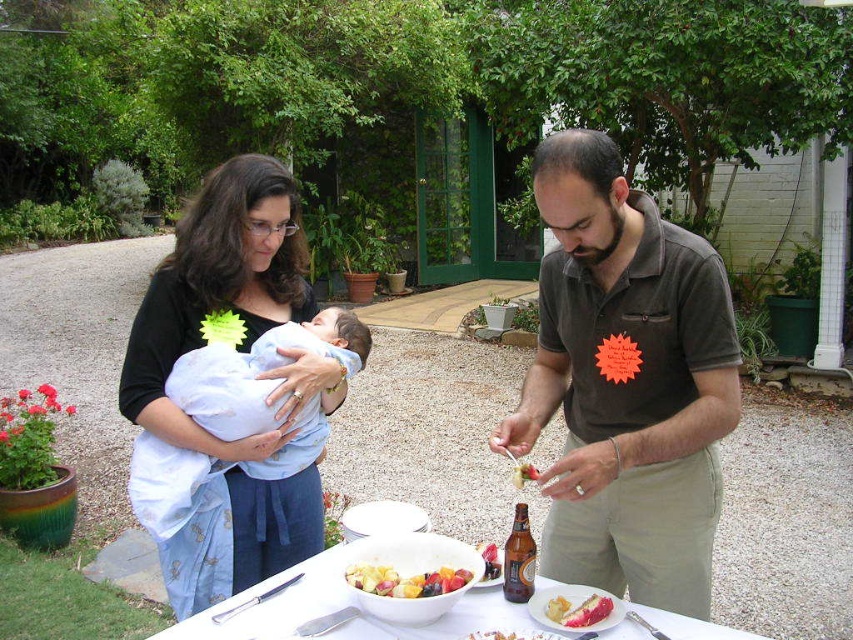
Can you confirm if white soft fabric baby at center is positioned below smooth pink cake at center?

No.

Which is more to the right, white soft fabric baby at center or smooth pink cake at center?

smooth pink cake at center is more to the right.

Image resolution: width=853 pixels, height=640 pixels. Identify the location of white soft fabric baby at center. (258, 371).

Find the location of a particular element. This screenshot has width=853, height=640. white soft fabric baby at center is located at coordinates (258, 371).

Which is above, brown cotton shirt at center or brown glass bottle at center?

brown cotton shirt at center

Is brown cotton shirt at center thinner than brown glass bottle at center?

Incorrect, brown cotton shirt at center's width is not less than brown glass bottle at center's.

Is point (660, 410) less distant than point (512, 529)?

Yes, it is.

This screenshot has height=640, width=853. Find the location of `brown cotton shirt at center`. brown cotton shirt at center is located at coordinates (625, 384).

Does matte brown shirt at center appear on the left side of smooth pink cake at center?

No, matte brown shirt at center is not to the left of smooth pink cake at center.

Measure the distance between matte brown shirt at center and smooth pink cake at center.

They are 17.98 inches apart.

Between point (234, 588) and point (610, 604), which one is positioned in front?

Positioned in front is point (610, 604).

This screenshot has height=640, width=853. In order to click on matte brown shirt at center in this screenshot , I will do `click(625, 384)`.